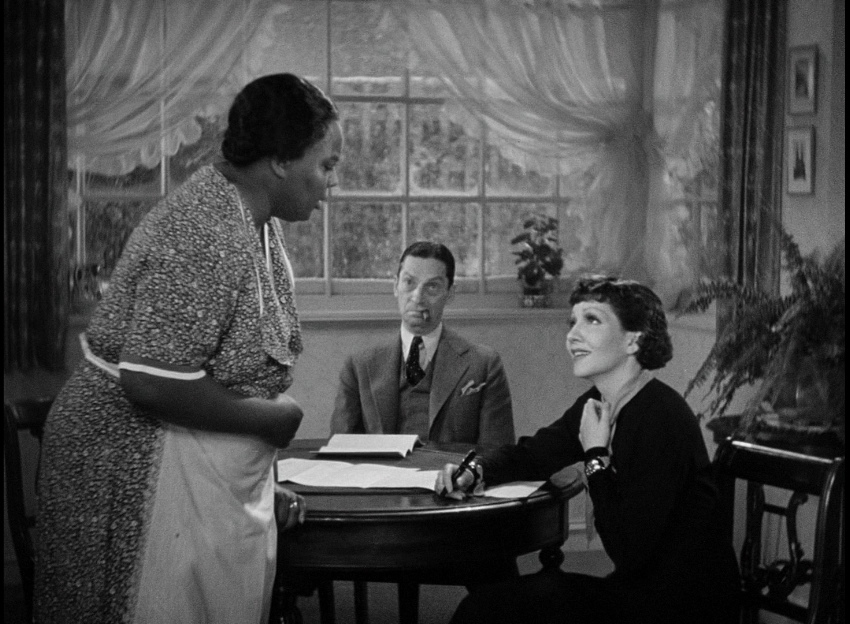
Where is `wall`? wall is located at coordinates (831, 228), (530, 386).